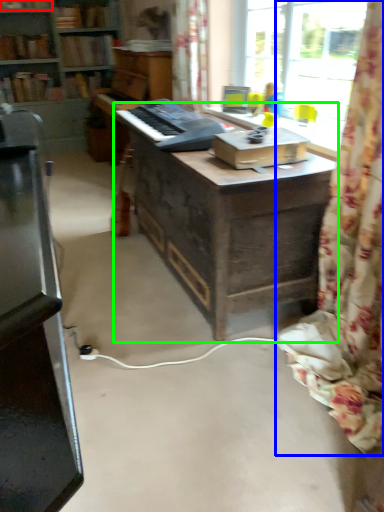
Question: Which object is the farthest from book (highlighted by a red box)? Choose among these: curtain (highlighted by a blue box) or table (highlighted by a green box).

Choices:
 (A) curtain
 (B) table

Answer: (A)